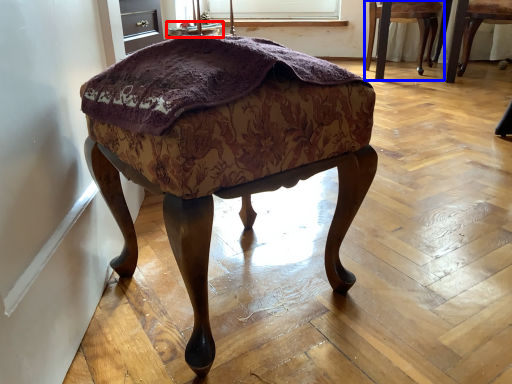
Question: Which object is further to the camera taking this photo, side table (highlighted by a red box) or chair (highlighted by a blue box)?

Choices:
 (A) side table
 (B) chair

Answer: (A)